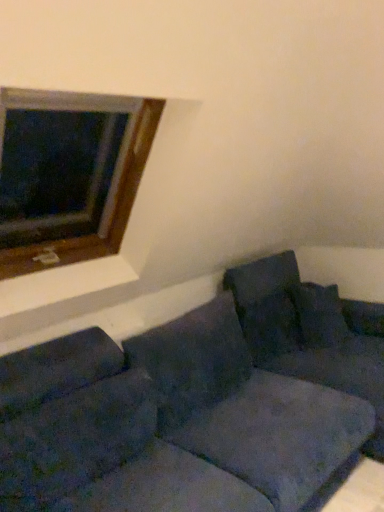
Question: From a real-world perspective, is wooden frame at upper left on velvety dark blue pillow at center, the second pillow from the right?

Choices:
 (A) no
 (B) yes

Answer: (B)

Question: Is wooden frame at upper left beside velvety dark blue pillow at center, the second pillow from the right?

Choices:
 (A) no
 (B) yes

Answer: (A)

Question: Considering the relative sizes of wooden frame at upper left and velvety dark blue pillow at center, the 2th pillow viewed from the left, in the image provided, is wooden frame at upper left thinner than velvety dark blue pillow at center, the 2th pillow viewed from the left,?

Choices:
 (A) yes
 (B) no

Answer: (B)

Question: Is wooden frame at upper left oriented towards velvety dark blue pillow at center, the 2th pillow viewed from the left?

Choices:
 (A) yes
 (B) no

Answer: (B)

Question: From the image's perspective, does wooden frame at upper left appear lower than velvety dark blue pillow at center, the second pillow from the right?

Choices:
 (A) no
 (B) yes

Answer: (A)

Question: Is wooden frame at upper left taller than velvety dark blue pillow at center, the 2th pillow viewed from the left?

Choices:
 (A) no
 (B) yes

Answer: (B)

Question: Can you confirm if velvety dark blue pillow at center, the second pillow from the right, is shorter than velvety dark blue pillow at center, the third pillow from the right?

Choices:
 (A) no
 (B) yes

Answer: (B)

Question: Is velvety dark blue pillow at center, the 2th pillow viewed from the left, facing away from velvety dark blue pillow at center, the third pillow from the right?

Choices:
 (A) no
 (B) yes

Answer: (A)

Question: Are velvety dark blue pillow at center, the 2th pillow viewed from the left, and velvety dark blue pillow at center, the third pillow from the right, far apart?

Choices:
 (A) yes
 (B) no

Answer: (B)

Question: Is velvety dark blue pillow at center, the 2th pillow viewed from the left, to the left of velvety dark blue pillow at center, the third pillow from the right, from the viewer's perspective?

Choices:
 (A) no
 (B) yes

Answer: (A)

Question: Is velvety dark blue pillow at center, the 2th pillow viewed from the left, facing towards velvety dark blue pillow at center, the first pillow viewed from the left?

Choices:
 (A) yes
 (B) no

Answer: (B)

Question: Is velvety dark blue pillow at center, the 2th pillow viewed from the left, behind velvety dark blue pillow at center, the first pillow viewed from the left?

Choices:
 (A) no
 (B) yes

Answer: (B)

Question: Does velvet dark blue pillow at right, which is the 3th pillow from left to right, have a greater height compared to wooden frame at upper left?

Choices:
 (A) no
 (B) yes

Answer: (A)